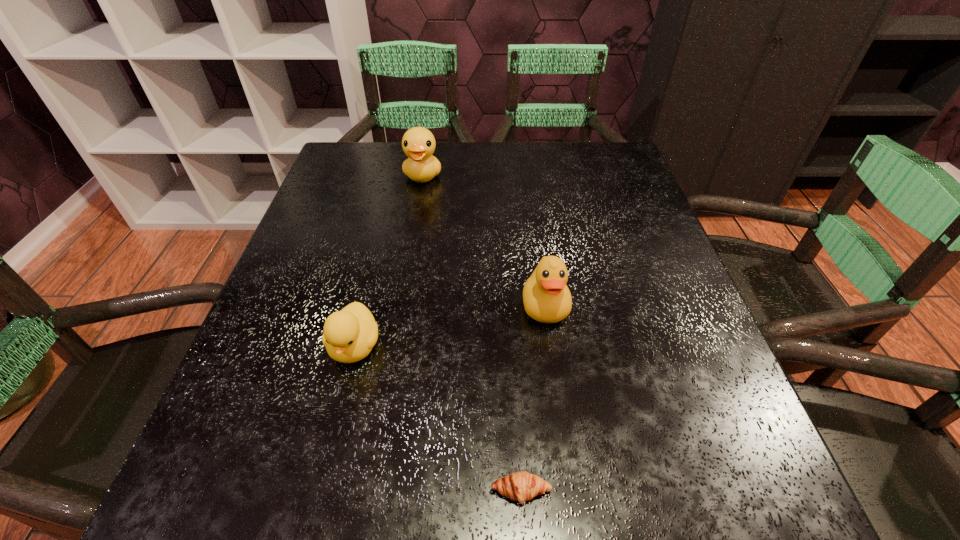
Locate an element on the screen. the farthest duck is located at coordinates (418, 143).

At what (x,y) coordinates should I click in order to perform the action: click on the rightmost duck. Please return your answer as a coordinate pair (x, y). The height and width of the screenshot is (540, 960). Looking at the image, I should click on (547, 299).

Find the location of a particular element. The image size is (960, 540). the second shortest object is located at coordinates (349, 335).

Locate an element on the screen. pastry is located at coordinates (521, 486).

I want to click on the shortest object, so click(x=521, y=486).

In order to click on free spot located on the face of the farthest duck in this screenshot , I will do `click(416, 220)`.

The width and height of the screenshot is (960, 540). Identify the location of blank space located at the beak of the rightmost duck. (560, 414).

This screenshot has height=540, width=960. Find the location of `vacant space located on the front-facing side of the shortest duck`. vacant space located on the front-facing side of the shortest duck is located at coordinates (317, 500).

Find the location of a particular element. The image size is (960, 540). object situated at the far edge is located at coordinates (418, 143).

The width and height of the screenshot is (960, 540). Find the location of `object positioned at the near edge`. object positioned at the near edge is located at coordinates (521, 486).